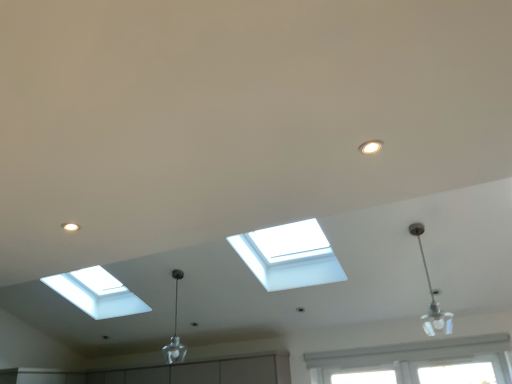
Question: Is silver metallic pendant light at right, which appears as the 1th lamp when viewed from the right, spatially inside clear glass pendant at center, which ranks as the second lamp in front-to-back order, or outside of it?

Choices:
 (A) inside
 (B) outside

Answer: (B)

Question: Is silver metallic pendant light at right, placed as the 1th lamp when sorted from front to back, wider or thinner than clear glass pendant at center, which is the 1th lamp in left-to-right order?

Choices:
 (A) thin
 (B) wide

Answer: (B)

Question: Considering their positions, is silver metallic pendant light at right, which appears as the 1th lamp when viewed from the right, located in front of or behind clear glass pendant at center, which ranks as the second lamp in front-to-back order?

Choices:
 (A) behind
 (B) front

Answer: (B)

Question: From the image's perspective, relative to silver metallic pendant light at right, the second lamp when ordered from left to right, is clear glass pendant at center, which is the 1th lamp in left-to-right order, above or below?

Choices:
 (A) above
 (B) below

Answer: (B)

Question: Visually, is clear glass pendant at center, which is counted as the first lamp, starting from the back, positioned to the left or to the right of silver metallic pendant light at right, the second lamp when ordered from left to right?

Choices:
 (A) right
 (B) left

Answer: (B)

Question: Is clear glass pendant at center, which ranks as the second lamp in front-to-back order, wider or thinner than silver metallic pendant light at right, which appears as the 1th lamp when viewed from the right?

Choices:
 (A) wide
 (B) thin

Answer: (B)

Question: In the image, is clear glass pendant at center, which is the 1th lamp in left-to-right order, positioned in front of or behind silver metallic pendant light at right, which appears as the 1th lamp when viewed from the right?

Choices:
 (A) front
 (B) behind

Answer: (B)